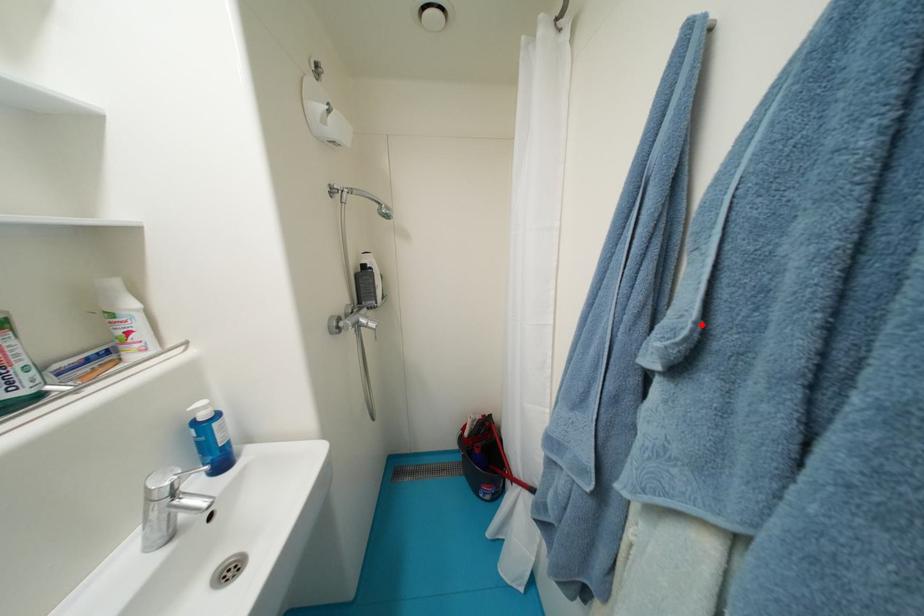
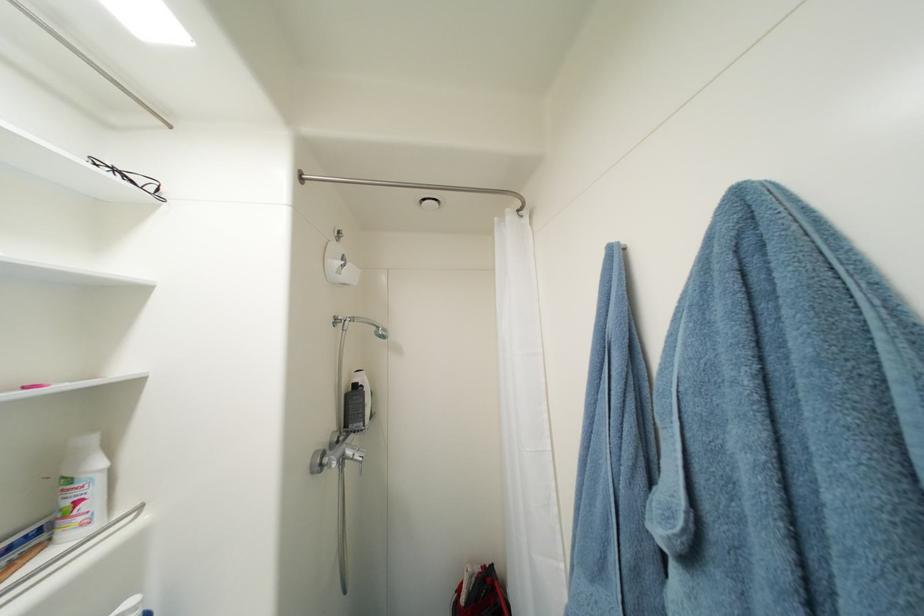
Question: I am providing you with two images of the same scene from different viewpoints. A red point is marked on the first image. At the location where the point appears in image 1, is it still visible in image 2?

Choices:
 (A) Yes
 (B) No

Answer: (A)